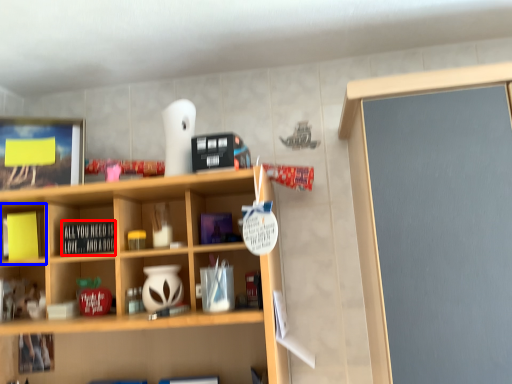
Question: Which of the following is the farthest to the observer, book (highlighted by a red box) or cabinet (highlighted by a blue box)?

Choices:
 (A) book
 (B) cabinet

Answer: (B)